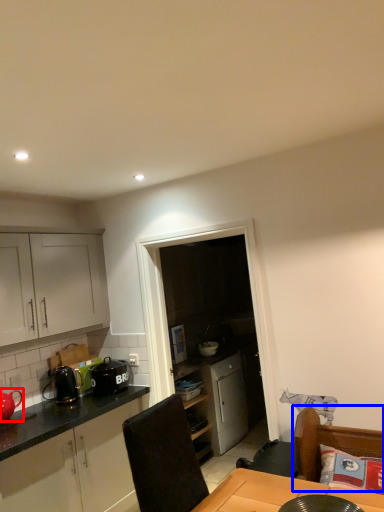
Question: Which object appears farthest to the camera in this image, tea pot (highlighted by a red box) or swivel chair (highlighted by a blue box)?

Choices:
 (A) tea pot
 (B) swivel chair

Answer: (A)